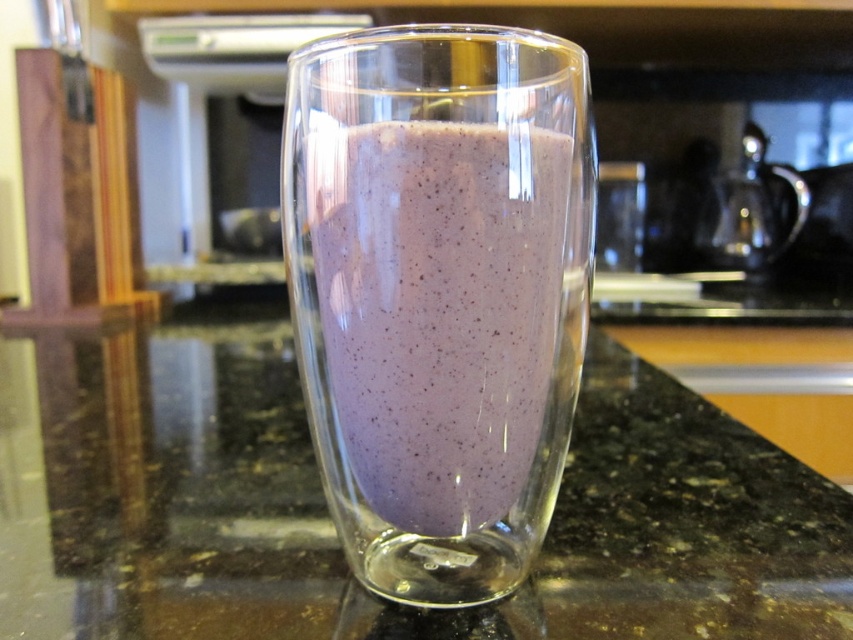
Question: Can you confirm if purple glass at center is positioned to the left of purple smoothie at center?

Choices:
 (A) no
 (B) yes

Answer: (B)

Question: Among these objects, which one is nearest to the camera?

Choices:
 (A) purple glass at center
 (B) purple smoothie at center

Answer: (B)

Question: Among these objects, which one is nearest to the camera?

Choices:
 (A) purple glass at center
 (B) purple smoothie at center

Answer: (B)

Question: Is purple glass at center smaller than purple smoothie at center?

Choices:
 (A) no
 (B) yes

Answer: (A)

Question: Is purple glass at center closer to the viewer compared to purple smoothie at center?

Choices:
 (A) yes
 (B) no

Answer: (B)